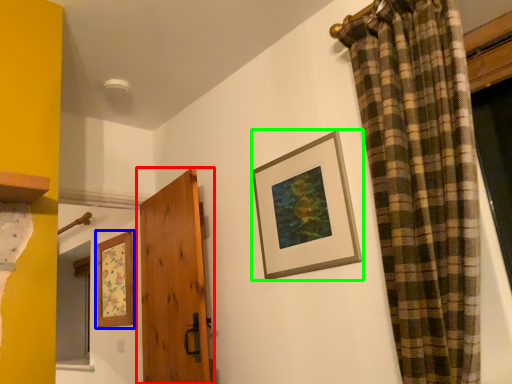
Question: Estimate the real-world distances between objects in this image. Which object is closer to door (highlighted by a red box), picture frame (highlighted by a blue box) or picture frame (highlighted by a green box)?

Choices:
 (A) picture frame
 (B) picture frame

Answer: (A)